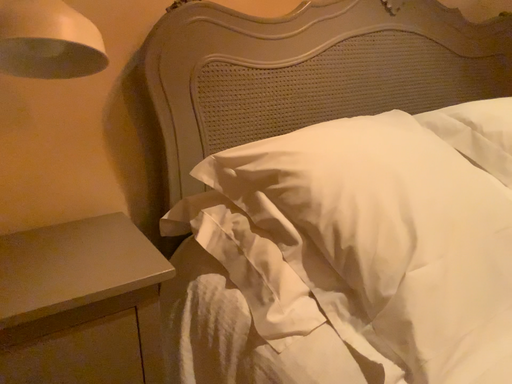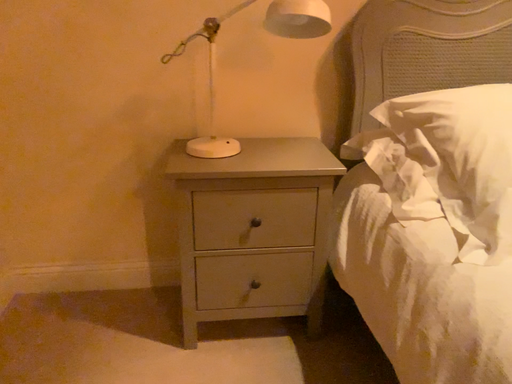
Question: How did the camera likely rotate when shooting the video?

Choices:
 (A) rotated left
 (B) rotated right

Answer: (A)